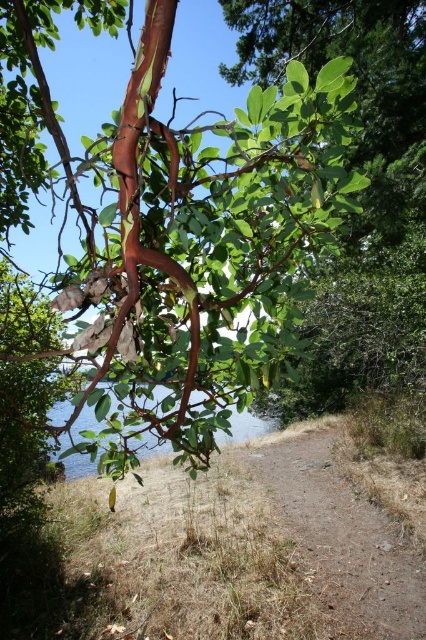
You are a gardener planning to plant flowers between the dried grass at center and the clear water at lower center. Given their widths, which area would require more space for planting?

The clear water at lower center is wider than the dried grass at center, so planting flowers there would require more space.

You are a hiker who wants to cross the clear water at lower center to reach the other side. The dried grass at center is nearby. Which area has more space to walk through?

The clear water at lower center has more space to walk through because it occupies more area than the dried grass at center.